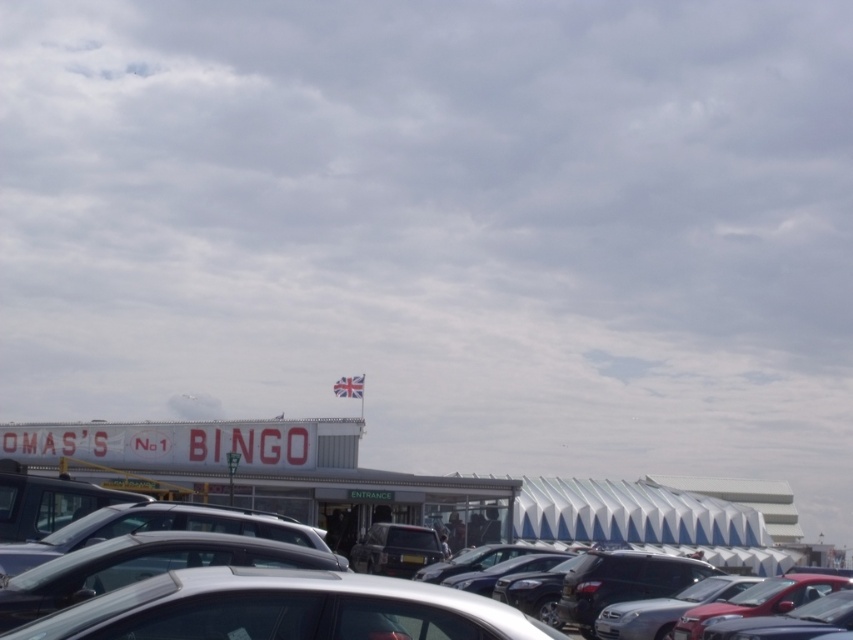
Question: In this image, where is silver metallic car at lower center located relative to shiny red car at lower right?

Choices:
 (A) left
 (B) right

Answer: (A)

Question: Does silver metallic car at center come behind shiny red car at lower right?

Choices:
 (A) yes
 (B) no

Answer: (B)

Question: Can you confirm if satin silver car at center is thinner than shiny red car at lower right?

Choices:
 (A) no
 (B) yes

Answer: (B)

Question: Which point is farther to the camera?

Choices:
 (A) shiny red car at lower right
 (B) silver metallic car at lower center
 (C) silver metallic car at center

Answer: (A)

Question: Among these points, which one is nearest to the camera?

Choices:
 (A) (225, 632)
 (B) (303, 540)

Answer: (A)

Question: Which object is the farthest from the silver metallic car at center?

Choices:
 (A) satin silver car at center
 (B) matte silver car at center

Answer: (A)